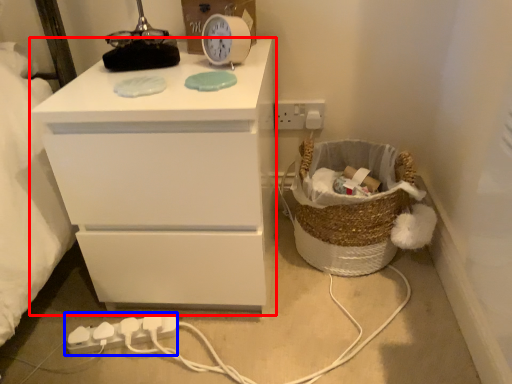
Question: Which of the following is the farthest to the observer, chest of drawers (highlighted by a red box) or extension cord (highlighted by a blue box)?

Choices:
 (A) chest of drawers
 (B) extension cord

Answer: (B)